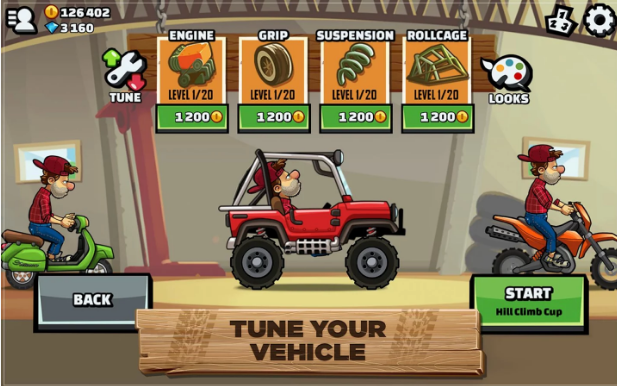
At what (x,y) coordinates should I click in order to perform the action: click on hood. Please return your answer as a coordinate pair (x, y). The image size is (617, 386). Looking at the image, I should click on (368, 203).